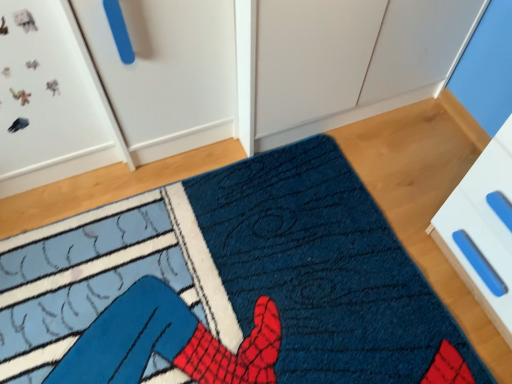
Question: Is textured blue rug at center positioned far away from white plastic drawer at lower right?

Choices:
 (A) no
 (B) yes

Answer: (A)

Question: From a real-world perspective, does textured blue rug at center sit lower than white plastic drawer at lower right?

Choices:
 (A) yes
 (B) no

Answer: (A)

Question: From a real-world perspective, is textured blue rug at center on white plastic drawer at lower right?

Choices:
 (A) yes
 (B) no

Answer: (B)

Question: Can you confirm if textured blue rug at center is taller than white plastic drawer at lower right?

Choices:
 (A) no
 (B) yes

Answer: (A)

Question: Is textured blue rug at center bigger than white plastic drawer at lower right?

Choices:
 (A) no
 (B) yes

Answer: (A)

Question: Is textured blue rug at center to the right of white plastic drawer at lower right from the viewer's perspective?

Choices:
 (A) yes
 (B) no

Answer: (B)

Question: Does white plastic drawer at lower right have a lesser width compared to textured blue rug at center?

Choices:
 (A) yes
 (B) no

Answer: (A)

Question: Is white plastic drawer at lower right shorter than textured blue rug at center?

Choices:
 (A) yes
 (B) no

Answer: (B)

Question: Is white plastic drawer at lower right oriented towards textured blue rug at center?

Choices:
 (A) no
 (B) yes

Answer: (B)

Question: Is white plastic drawer at lower right in front of textured blue rug at center?

Choices:
 (A) yes
 (B) no

Answer: (A)

Question: Is white plastic drawer at lower right at the left side of textured blue rug at center?

Choices:
 (A) yes
 (B) no

Answer: (B)

Question: Can you confirm if white plastic drawer at lower right is bigger than textured blue rug at center?

Choices:
 (A) no
 (B) yes

Answer: (B)

Question: Looking at their shapes, would you say white plastic drawer at lower right is wider or thinner than textured blue rug at center?

Choices:
 (A) wide
 (B) thin

Answer: (B)